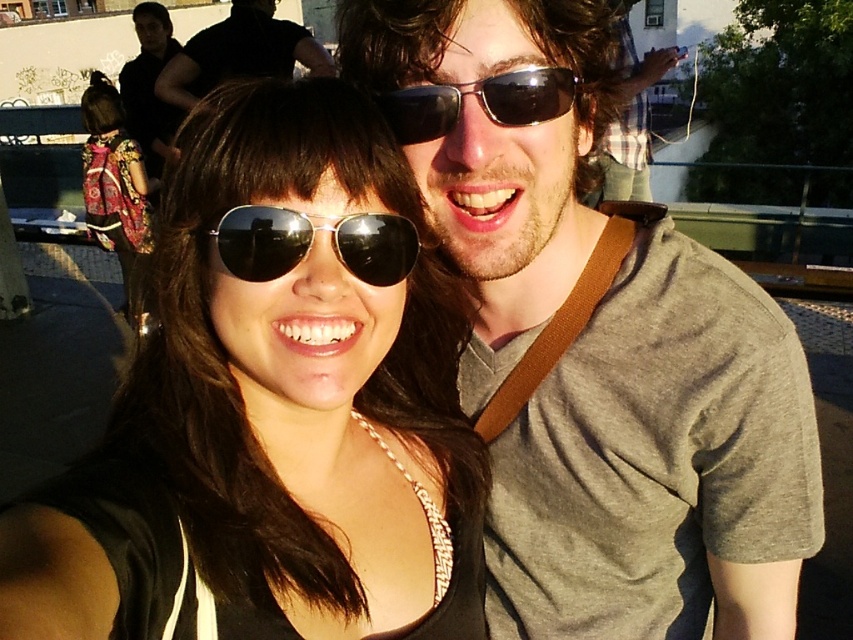
Is matte black sunglasses at center bigger than gray cotton t-shirt at upper right?

No, matte black sunglasses at center is not bigger than gray cotton t-shirt at upper right.

Does matte black sunglasses at center appear over gray cotton t-shirt at upper right?

No, matte black sunglasses at center is not above gray cotton t-shirt at upper right.

Where is `matte black sunglasses at center`? This screenshot has width=853, height=640. matte black sunglasses at center is located at coordinates (273, 406).

Is aviator sunglasses at center positioned at the back of patterned fabric dress at left?

No, it is not.

Does aviator sunglasses at center come in front of patterned fabric dress at left?

Yes.

Locate an element on the screen. aviator sunglasses at center is located at coordinates (312, 241).

Which is in front, point (112, 122) or point (392, 124)?

Positioned in front is point (392, 124).

Is patterned fabric dress at left taller than black reflective sunglasses at upper center?

Indeed, patterned fabric dress at left has a greater height compared to black reflective sunglasses at upper center.

Between point (119, 148) and point (509, 113), which one is positioned behind?

The point (119, 148) is more distant.

The width and height of the screenshot is (853, 640). I want to click on patterned fabric dress at left, so click(x=114, y=182).